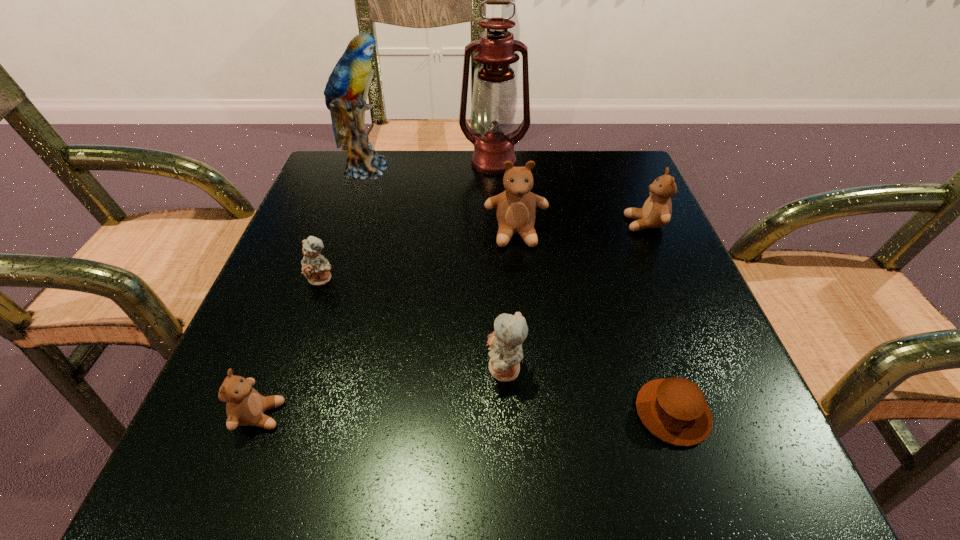
Find the location of `red oil lamp`. red oil lamp is located at coordinates (495, 97).

Find the location of `parrot`. parrot is located at coordinates (349, 77).

Locate an element on the screen. The height and width of the screenshot is (540, 960). the second brown teddy bear from left to right is located at coordinates (516, 207).

The height and width of the screenshot is (540, 960). Identify the location of the tallest teddy bear. (516, 207).

This screenshot has height=540, width=960. What are the coordinates of `the rightmost brown teddy bear` in the screenshot? It's located at (656, 212).

Where is `the second smallest brown teddy bear`? the second smallest brown teddy bear is located at coordinates (656, 212).

At what (x,y) coordinates should I click in order to perform the action: click on the nearer blue teddy bear. Please return your answer as a coordinate pair (x, y). This screenshot has width=960, height=540. Looking at the image, I should click on (505, 342).

Where is `the second nearest teddy bear`? the second nearest teddy bear is located at coordinates (505, 342).

Where is `the third nearest teddy bear`? Image resolution: width=960 pixels, height=540 pixels. the third nearest teddy bear is located at coordinates (315, 267).

In order to click on the left blue teddy bear in this screenshot , I will do `click(315, 267)`.